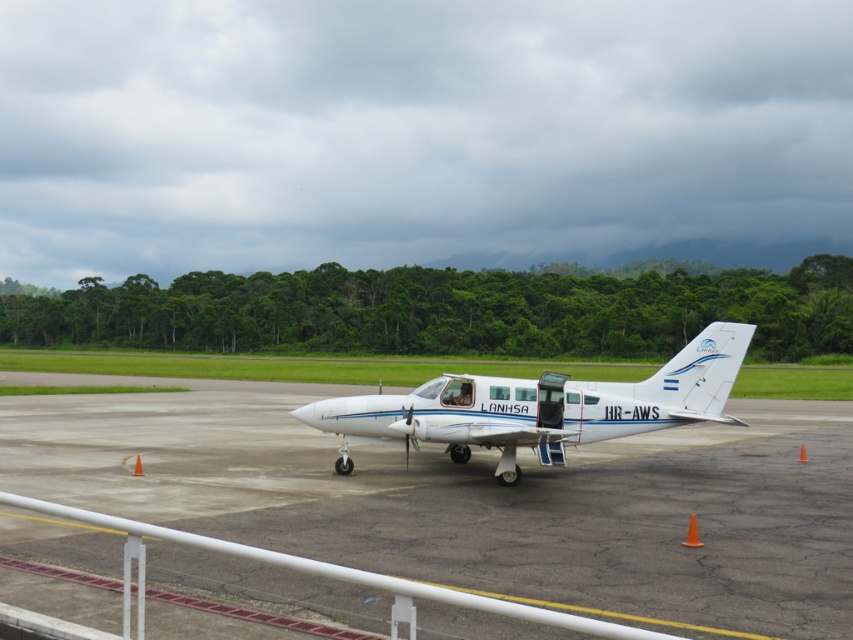
You are a pilot standing at the white smooth tarmac at center. You need to board the white glossy airplane at center. Which direction should you move to reach the airplane?

The white smooth tarmac at center is in front of the white glossy airplane at center, so you should move backward to reach the airplane.

You are a pilot preparing to board passengers onto the white glossy airplane at center. You notice the white smooth tarmac at center nearby. Which object is located to the right of the airplane?

The white smooth tarmac at center is positioned on the right side of the white glossy airplane at center.

You are a pilot who needs to park the white glossy airplane at center on the white smooth tarmac at center. Considering the size difference between them, will the airplane fit entirely on the tarmac?

The white smooth tarmac at center has a larger size compared to the white glossy airplane at center, so the airplane will fit entirely on the tarmac.